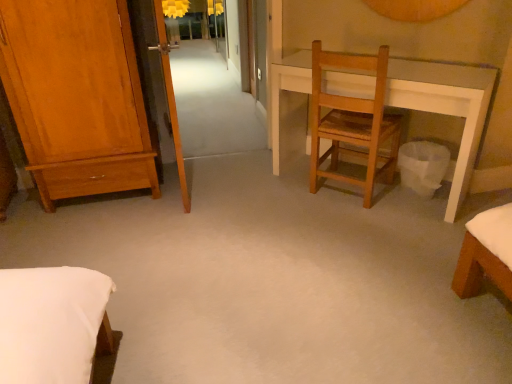
Describe the element at coordinates (158, 83) in the screenshot. I see `transparent glass screen door at upper left` at that location.

Where is `white paper trash can at lower right`? Image resolution: width=512 pixels, height=384 pixels. white paper trash can at lower right is located at coordinates (423, 166).

Where is `transparent glass screen door at upper left`? The width and height of the screenshot is (512, 384). transparent glass screen door at upper left is located at coordinates (158, 83).

From a real-world perspective, does white paper trash can at lower right sit lower than shiny brown wardrobe at left?

Correct, in the physical world, white paper trash can at lower right is lower than shiny brown wardrobe at left.

Is white paper trash can at lower right next to shiny brown wardrobe at left and touching it?

white paper trash can at lower right is not next to shiny brown wardrobe at left, and they're not touching.

Which object is wider, white paper trash can at lower right or shiny brown wardrobe at left?

shiny brown wardrobe at left.

Considering the sizes of objects white paper trash can at lower right and shiny brown wardrobe at left in the image provided, who is shorter, white paper trash can at lower right or shiny brown wardrobe at left?

white paper trash can at lower right.

Consider the image. Is wooden chair at center in front of or behind white paper trash can at lower right in the image?

In the image, wooden chair at center appears in front of white paper trash can at lower right.

Are wooden chair at center and white paper trash can at lower right making contact?

No, wooden chair at center is not making contact with white paper trash can at lower right.

Is wooden chair at center not within white paper trash can at lower right?

Yes, wooden chair at center is not within white paper trash can at lower right.

Is wooden chair at center to the left of white paper trash can at lower right from the viewer's perspective?

Yes.

From the image's perspective, between shiny brown wardrobe at left and transparent glass screen door at upper left, which one is located above?

transparent glass screen door at upper left, from the image's perspective.

Is point (54, 126) positioned behind point (150, 71)?

No, it is in front of (150, 71).

Do you think shiny brown wardrobe at left is within transparent glass screen door at upper left, or outside of it?

shiny brown wardrobe at left is located beyond the bounds of transparent glass screen door at upper left.

From the image's perspective, would you say wooden chair at center is shown under shiny brown wardrobe at left?

Yes, from the image's perspective, wooden chair at center is beneath shiny brown wardrobe at left.

How distant is wooden chair at center from shiny brown wardrobe at left?

wooden chair at center and shiny brown wardrobe at left are 4.24 feet apart from each other.

Could you tell me if wooden chair at center is facing shiny brown wardrobe at left?

No, wooden chair at center is not facing towards shiny brown wardrobe at left.

Considering the relative sizes of wooden chair at center and shiny brown wardrobe at left in the image provided, is wooden chair at center thinner than shiny brown wardrobe at left?

Correct, the width of wooden chair at center is less than that of shiny brown wardrobe at left.

Is the position of matte yellow lampshade at upper center more distant than that of white paper trash can at lower right?

Yes, it is behind white paper trash can at lower right.

Measure the distance from matte yellow lampshade at upper center to white paper trash can at lower right.

A distance of 12.76 feet exists between matte yellow lampshade at upper center and white paper trash can at lower right.

Does point (168, 8) come in front of point (430, 177)?

No.

How many degrees apart are the facing directions of matte yellow lampshade at upper center and white paper trash can at lower right?

45.5 degrees.

Is transparent glass screen door at upper left beside matte yellow lampshade at upper center?

No, transparent glass screen door at upper left is not beside matte yellow lampshade at upper center.

You are a GUI agent. You are given a task and a screenshot of the screen. Output one action in this format:
    pyautogui.click(x=<x>, y=<y>)
    Task: Click on the lamp that appears below the transparent glass screen door at upper left (from a real-world perspective)
    The width and height of the screenshot is (512, 384).
    Given the screenshot: What is the action you would take?
    pyautogui.click(x=175, y=8)

How far apart are transparent glass screen door at upper left and matte yellow lampshade at upper center?

The distance of transparent glass screen door at upper left from matte yellow lampshade at upper center is 2.90 meters.

Is point (178, 160) farther from camera compared to point (165, 6)?

No, it is in front of (165, 6).

Considering the sizes of objects white paper trash can at lower right and wooden chair at center in the image provided, who is wider, white paper trash can at lower right or wooden chair at center?

wooden chair at center.

Do you think white paper trash can at lower right is within wooden chair at center, or outside of it?

white paper trash can at lower right is spatially situated outside wooden chair at center.

From a real-world perspective, is white paper trash can at lower right on top of wooden chair at center?

No, from a real-world perspective, white paper trash can at lower right is not on top of wooden chair at center.

Can you tell me how much white paper trash can at lower right and wooden chair at center differ in facing direction?

179 degrees separate the facing orientations of white paper trash can at lower right and wooden chair at center.

Where is `trash bin/can behind the shiny brown wardrobe at left`? trash bin/can behind the shiny brown wardrobe at left is located at coordinates (423, 166).

In the image, there is a wooden chair at center. Where is `trash bin/can below it (from a real-world perspective)`? The width and height of the screenshot is (512, 384). trash bin/can below it (from a real-world perspective) is located at coordinates (423, 166).

Looking at the image, which one is located further to transparent glass screen door at upper left, matte yellow lampshade at upper center or shiny brown wardrobe at left?

matte yellow lampshade at upper center lies further to transparent glass screen door at upper left than the other object.

Estimate the real-world distances between objects in this image. Which object is closer to shiny brown wardrobe at left, matte yellow lampshade at upper center or transparent glass screen door at upper left?

transparent glass screen door at upper left lies closer to shiny brown wardrobe at left than the other object.

Based on their spatial positions, is wooden chair at center or white paper trash can at lower right closer to matte yellow lampshade at upper center?

wooden chair at center is positioned closer to the anchor matte yellow lampshade at upper center.

Which object lies nearer to the anchor point matte yellow lampshade at upper center, white paper trash can at lower right or transparent glass screen door at upper left?

transparent glass screen door at upper left.

When comparing their distances from matte yellow lampshade at upper center, does shiny brown wardrobe at left or white paper trash can at lower right seem further?

white paper trash can at lower right is positioned further to the anchor matte yellow lampshade at upper center.

Considering their positions, is matte yellow lampshade at upper center positioned closer to wooden chair at center than shiny brown wardrobe at left?

shiny brown wardrobe at left lies closer to wooden chair at center than the other object.

Considering their positions, is wooden chair at center positioned further to transparent glass screen door at upper left than white paper trash can at lower right?

white paper trash can at lower right lies further to transparent glass screen door at upper left than the other object.

From the picture: Which object lies further to the anchor point shiny brown wardrobe at left, transparent glass screen door at upper left or matte yellow lampshade at upper center?

matte yellow lampshade at upper center is further to shiny brown wardrobe at left.

In order to click on screen door between shiny brown wardrobe at left and wooden chair at center in this screenshot , I will do `click(158, 83)`.

Find the location of `chair between transparent glass screen door at upper left and matte yellow lampshade at upper center along the z-axis`. chair between transparent glass screen door at upper left and matte yellow lampshade at upper center along the z-axis is located at coordinates (352, 121).

This screenshot has width=512, height=384. Identify the location of screen door situated between shiny brown wardrobe at left and white paper trash can at lower right from left to right. (158, 83).

The width and height of the screenshot is (512, 384). In order to click on chair situated between shiny brown wardrobe at left and white paper trash can at lower right from left to right in this screenshot , I will do `click(352, 121)`.